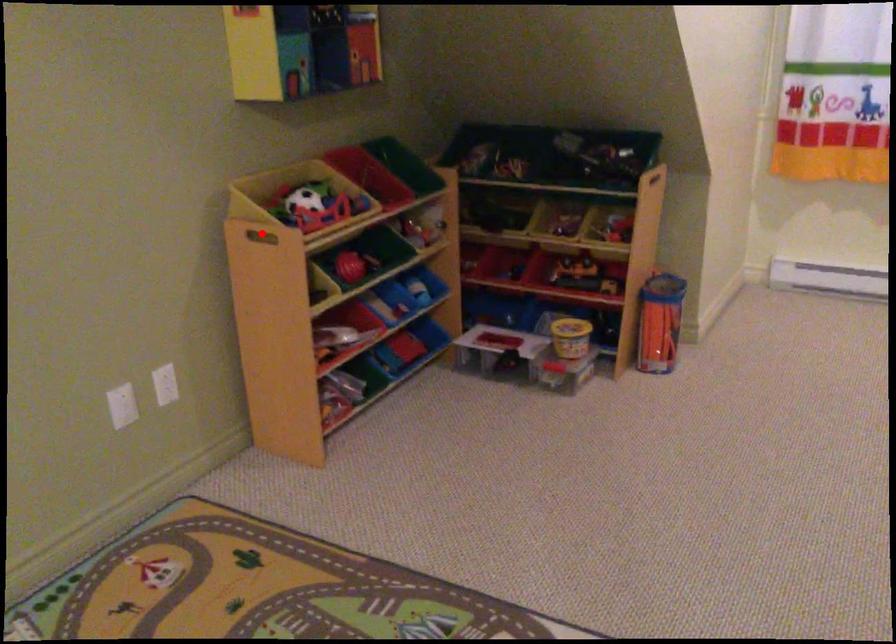
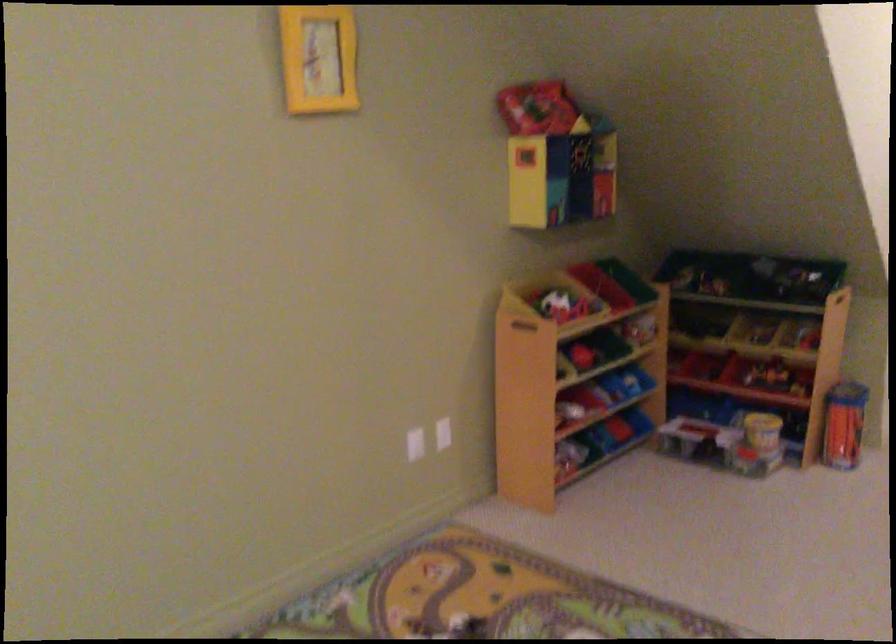
Locate, in the second image, the point that corresponds to the highlighted location in the first image.

(519, 321)